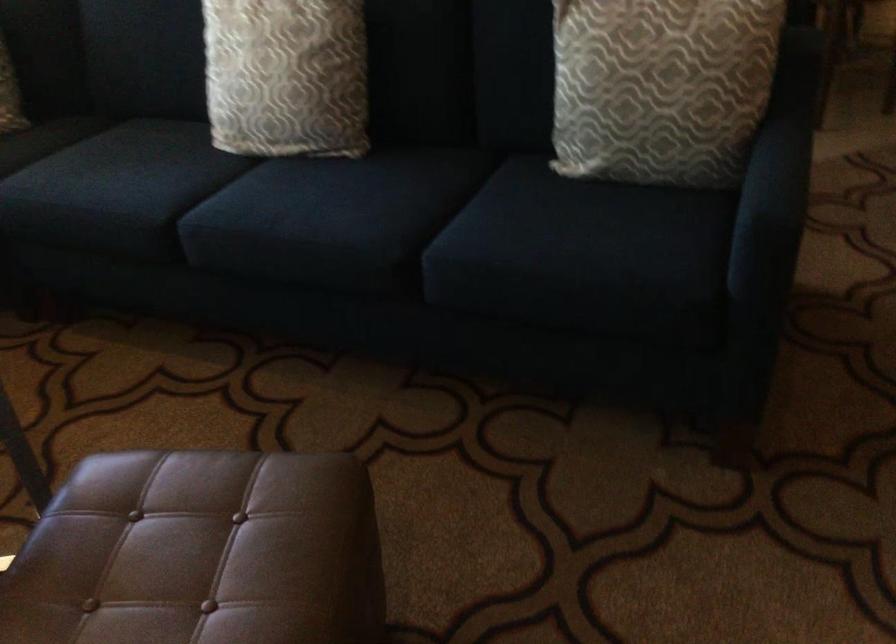
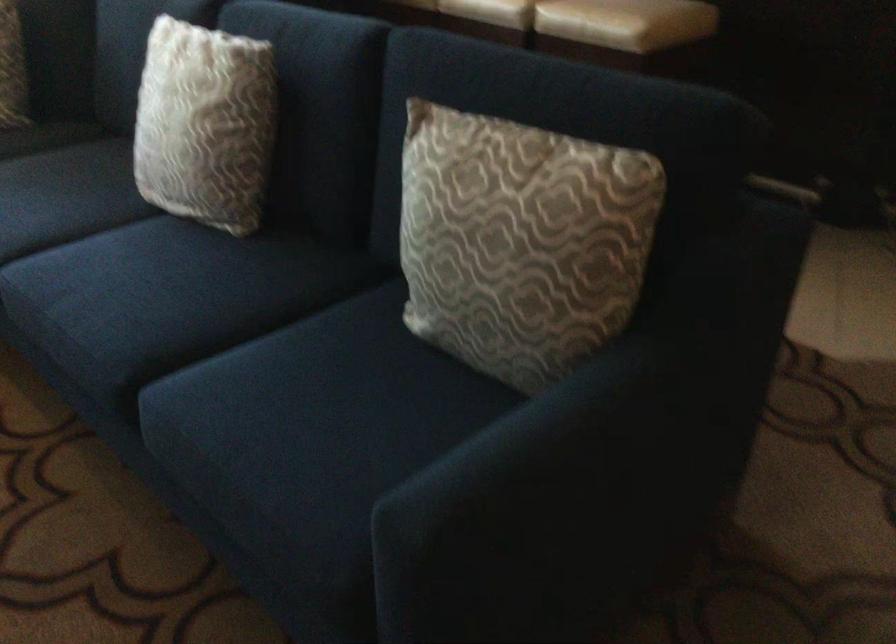
In a continuous first-person perspective shot, in which direction is the camera moving?

The movement direction of the cameraman is right, forward.